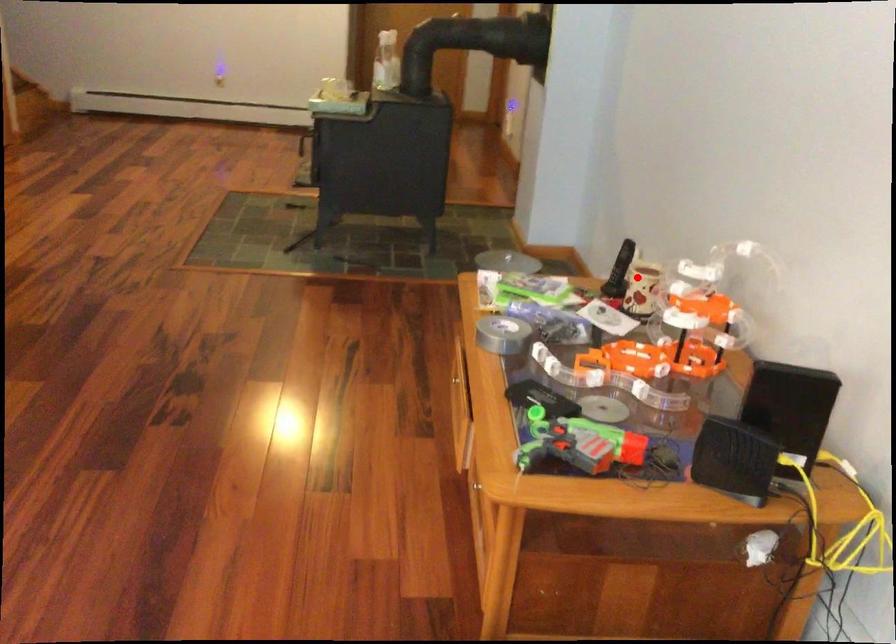
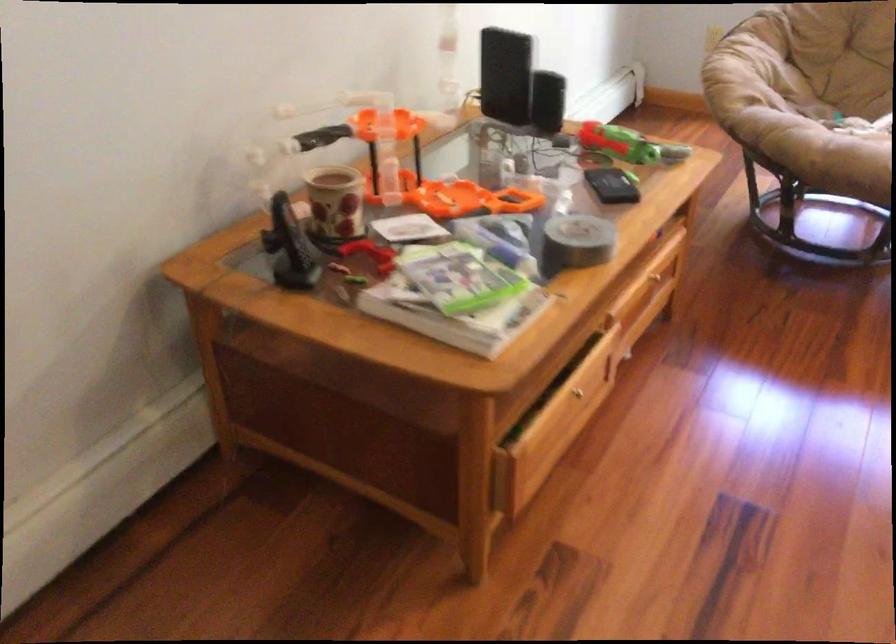
Locate, in the second image, the point that corresponds to the highlighted location in the first image.

(334, 203)